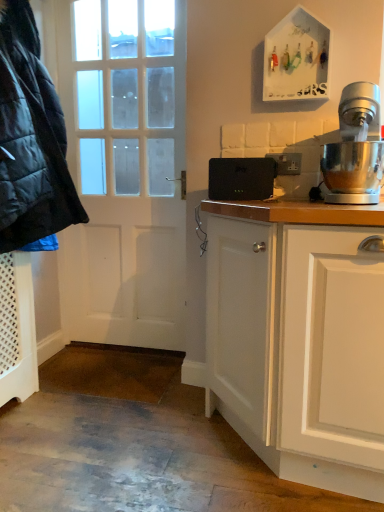
Where is `free spot below matte black jacket at left (from a real-world perspective)`? Image resolution: width=384 pixels, height=512 pixels. free spot below matte black jacket at left (from a real-world perspective) is located at coordinates (51, 403).